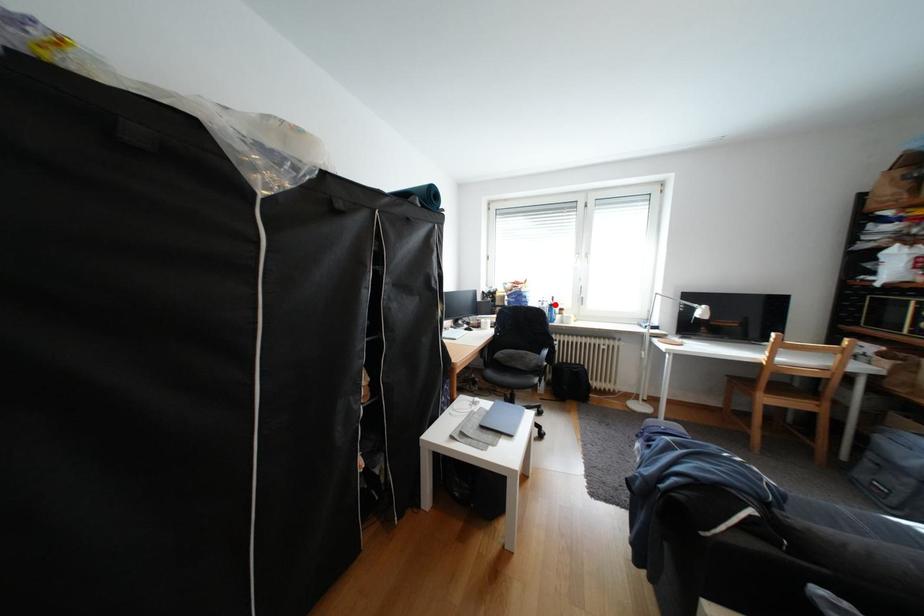
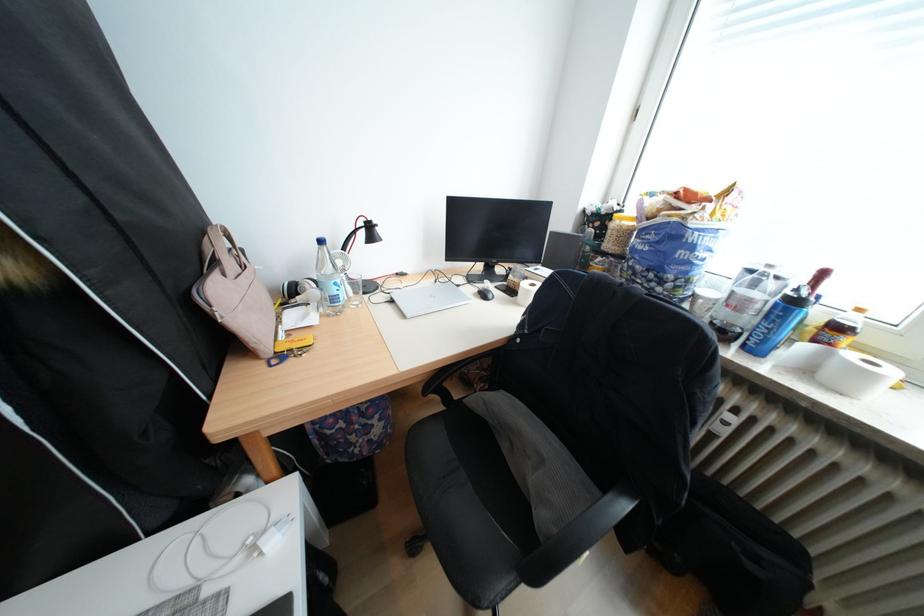
Where in the second image is the point corresponding to the highlighted location from the first image?

(767, 285)